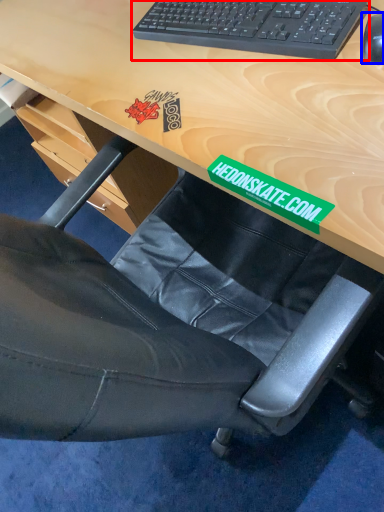
Question: Which of the following is the closest to the observer, computer keyboard (highlighted by a red box) or mouse (highlighted by a blue box)?

Choices:
 (A) computer keyboard
 (B) mouse

Answer: (B)